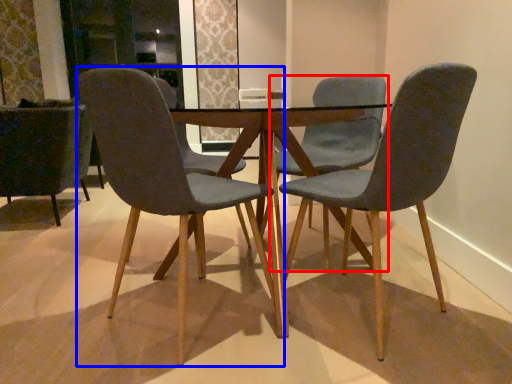
Question: Which object is closer to the camera taking this photo, chair (highlighted by a red box) or chair (highlighted by a blue box)?

Choices:
 (A) chair
 (B) chair

Answer: (B)